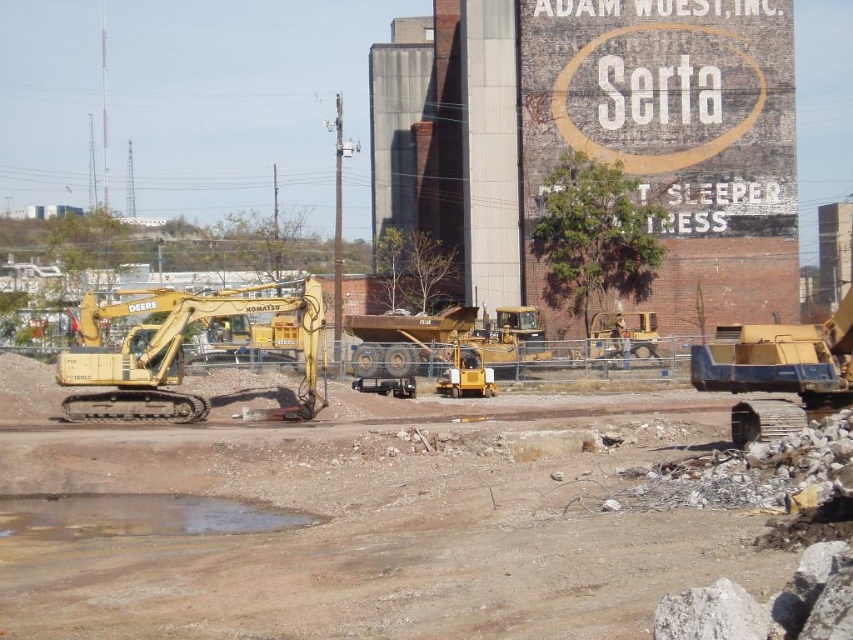
Question: Is yellow metallic excavator at left below yellow metallic bulldozer at center?

Choices:
 (A) no
 (B) yes

Answer: (A)

Question: Which point appears farthest from the camera in this image?

Choices:
 (A) (741, 417)
 (B) (610, 330)
 (C) (631, 461)

Answer: (B)

Question: Which object is the closest to the yellow metallic excavator at right?

Choices:
 (A) yellow metallic bulldozer at center
 (B) brown dirt field at center
 (C) yellow metallic excavator at left

Answer: (B)

Question: Is brown dirt field at center thinner than yellow metallic bulldozer at center?

Choices:
 (A) yes
 (B) no

Answer: (B)

Question: Where is brown dirt field at center located in relation to yellow metallic excavator at left in the image?

Choices:
 (A) above
 (B) below

Answer: (B)

Question: Which object appears closest to the camera in this image?

Choices:
 (A) yellow metallic excavator at right
 (B) yellow metallic excavator at left
 (C) brown dirt field at center
 (D) yellow metallic bulldozer at center

Answer: (C)